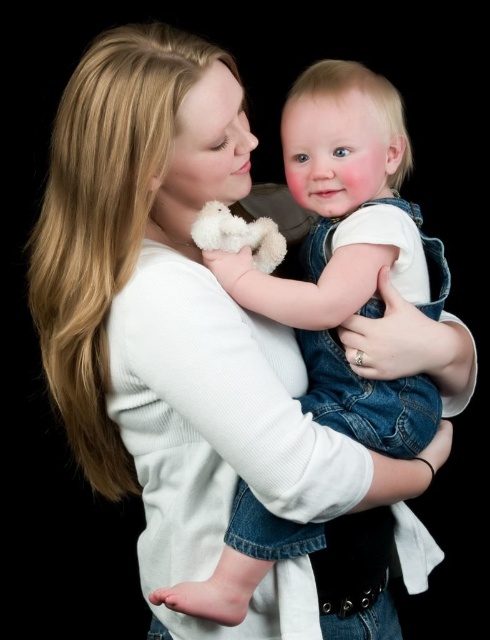
You are a photographer who wants to capture a closeup of the baby while ensuring both the denim overalls at center and the white plush teddy bear at center are visible in the shot. Which object should you focus on to ensure the smaller one is in frame?

The white plush teddy bear at center is smaller than the denim overalls at center. To ensure both are visible, focus on the denim overalls at center and adjust the framing to include the smaller teddy bear.

You are a photographer setting up a shoot with the adult and baby in the image. You need to place a small prop between the denim overalls at center and the white plush teddy bear at center. Based on their sizes, which object should the prop be placed closer to?

The prop should be placed closer to the white plush teddy bear at center because the denim overalls at center is wider than the white plush teddy bear at center, so the teddy bear is narrower and the prop can be positioned nearer to it without overlapping.